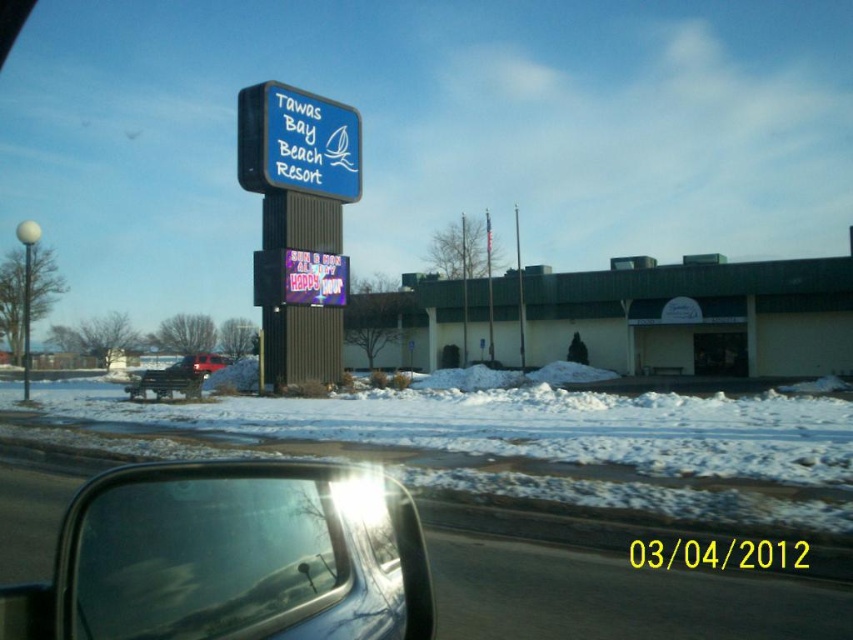
You are a passenger in the car and want to take a photo of the red matte truck at center through the transparent glass car window at lower left. Will the truck be visible through the window?

The transparent glass car window at lower left is above the red matte truck at center, so the truck is below the window. Since the window is above the truck, the passenger cannot see the truck through the window because it is positioned below the window.